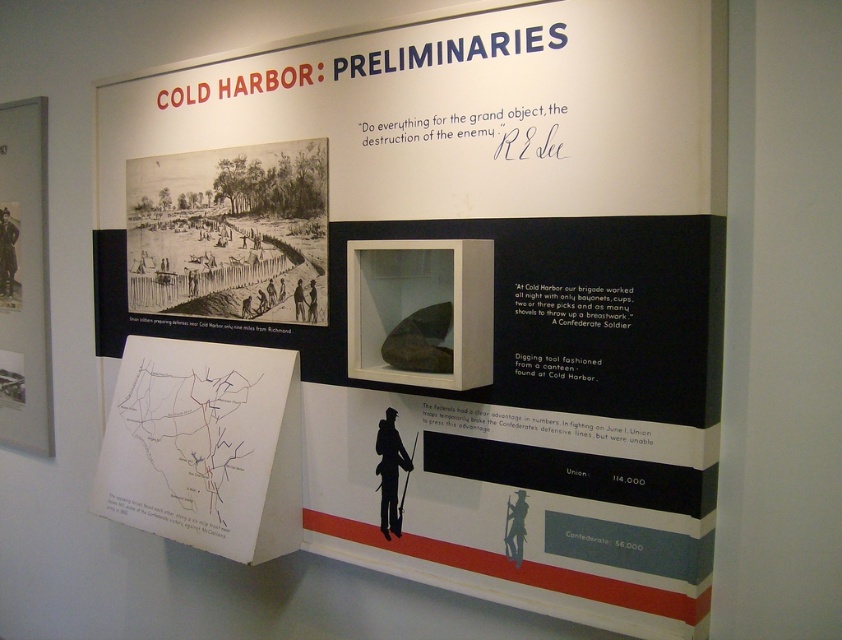
Between white paper map at lower left and black paper at upper left, which one has more height?

white paper map at lower left

Between white paper map at lower left and black paper at upper left, which one is positioned higher?

Positioned higher is black paper at upper left.

The height and width of the screenshot is (640, 842). I want to click on white paper map at lower left, so click(x=204, y=445).

Does black paper at upper left have a lesser width compared to matte paper map at left?

Incorrect, black paper at upper left's width is not less than matte paper map at left's.

The width and height of the screenshot is (842, 640). What are the coordinates of `black paper at upper left` in the screenshot? It's located at (228, 230).

Can you confirm if white paper map at lower left is positioned to the right of matte paper map at left?

Indeed, white paper map at lower left is positioned on the right side of matte paper map at left.

Can you confirm if white paper map at lower left is positioned to the left of matte paper map at left?

Incorrect, white paper map at lower left is not on the left side of matte paper map at left.

Is point (214, 465) positioned before point (25, 440)?

Yes.

Where is `white paper map at lower left`? white paper map at lower left is located at coordinates (204, 445).